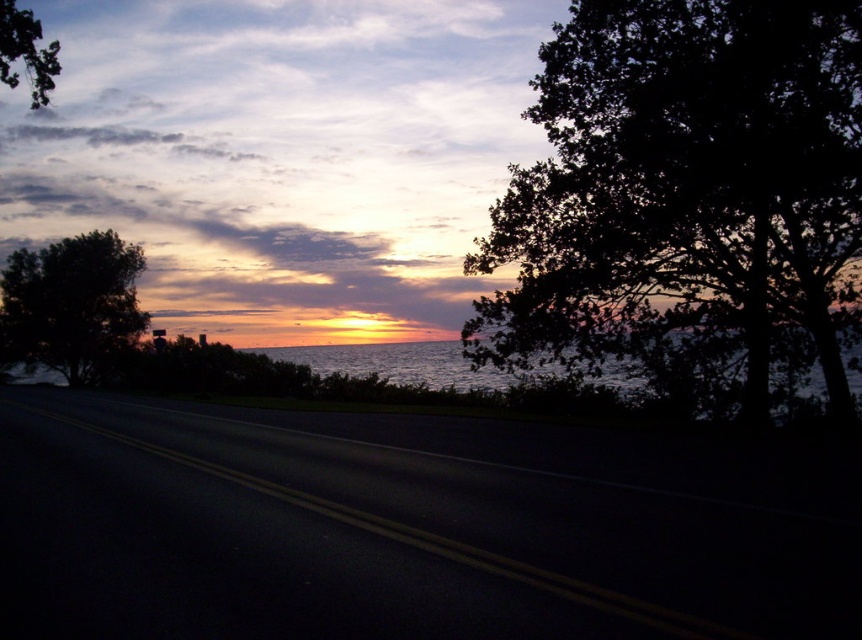
You are a driver approaching the coastal road at sunset. You notice the shimmering silver water at center and the green leafy tree at upper left in your view. Which of these two objects appears larger in your field of view?

The green leafy tree at upper left appears larger than the shimmering silver water at center.

You are a driver approaching the coastal road at sunset. You notice the shimmering silver water at center and the green leafy tree at upper left in your view. Which object appears taller in the scene?

The green leafy tree at upper left appears taller than the shimmering silver water at center.

You are standing on the coastal road at sunset and want to walk from point A to point B. Point A is located at coordinates point (84, 243) and point B is at point (5, 8). Which point is closer to you if you are facing the road ahead?

Point (84, 243) is further to the viewer than point (5, 8), so point (5, 8) is closer to you when facing the road ahead.